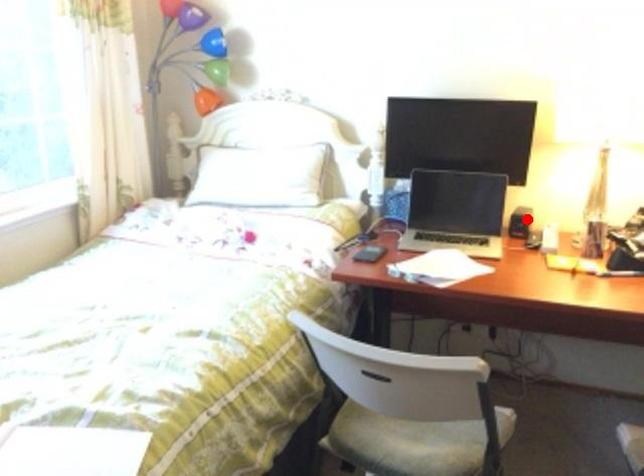
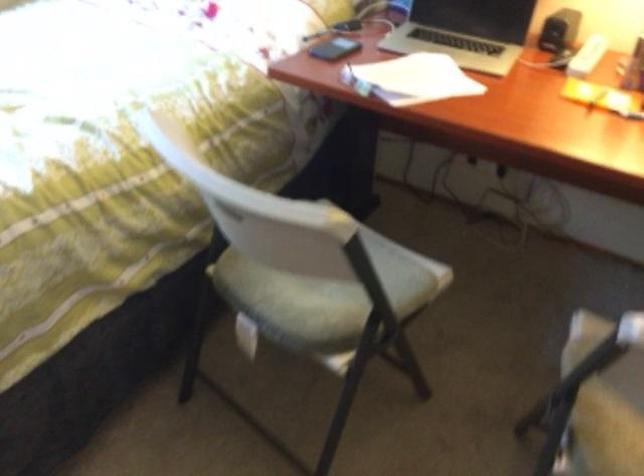
Question: I am providing you with two images of the same scene from different viewpoints. In image1, a red point is highlighted. Considering the same 3D point in image2, which of the following is correct?

Choices:
 (A) It is closer
 (B) It is farther

Answer: (A)